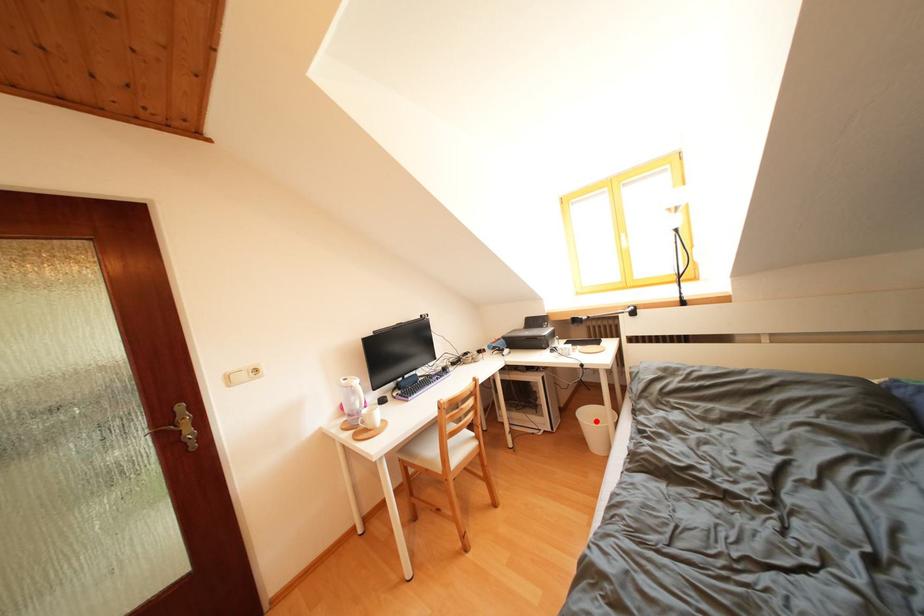
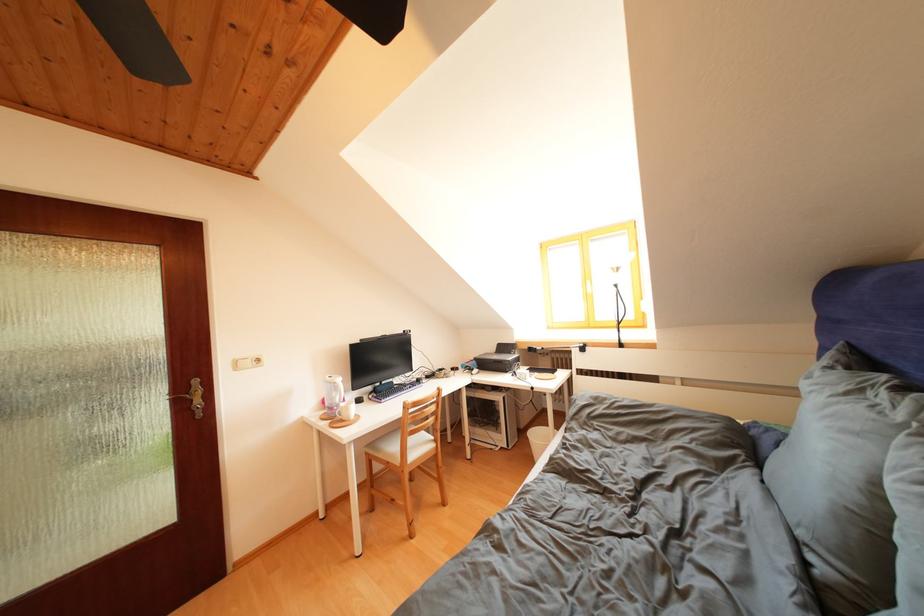
Question: I am providing you with two images of the same scene from different viewpoints. In image1, a red point is highlighted. Considering the same 3D point in image2, which of the following is correct?

Choices:
 (A) It is closer
 (B) It is farther

Answer: (B)